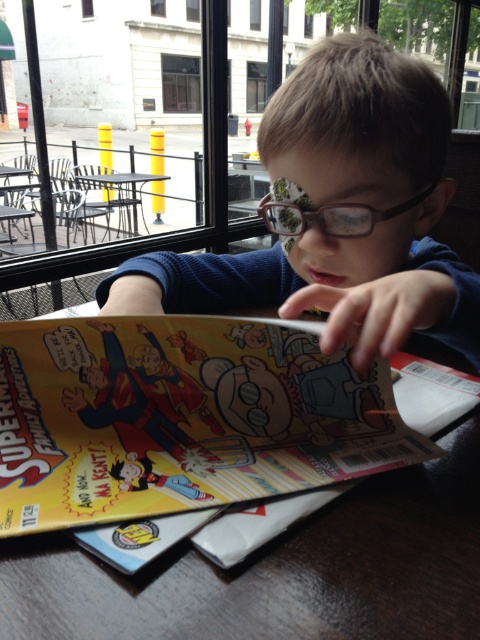
You are a photographer trying to capture the boy and the comic book in the scene. You notice two points in the image at coordinates point (407,211) and point (310,218). Which point is closer to your camera lens?

Point (407,211) is further to the viewer than point (310,218). Therefore, point (310,218) is closer to the camera lens.

You are trying to reach for the glasses that are closer to you. Which one should you choose between the brown matte glasses at center and the brown plastic glasses at center?

You should choose the brown matte glasses at center because it is closer to the viewer than the brown plastic glasses at center.